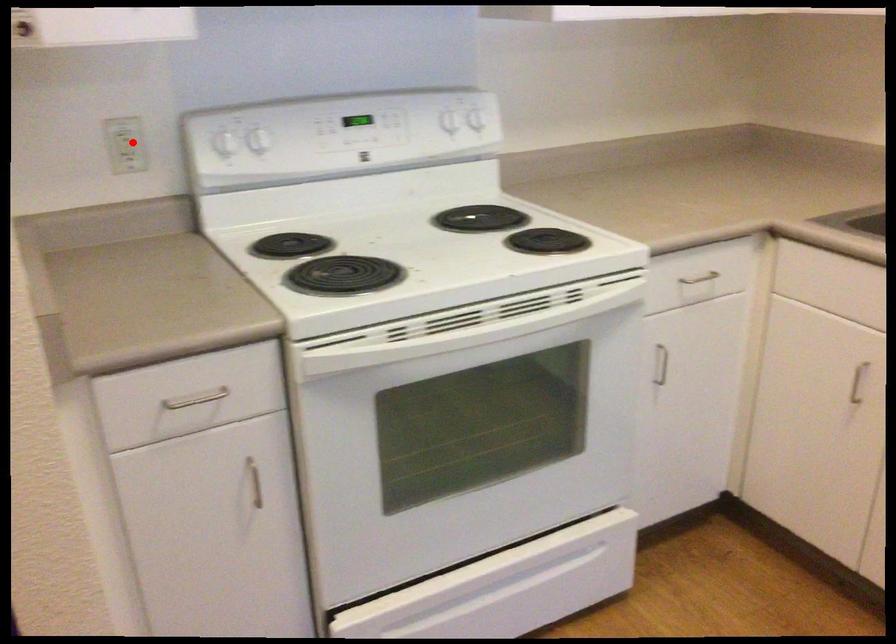
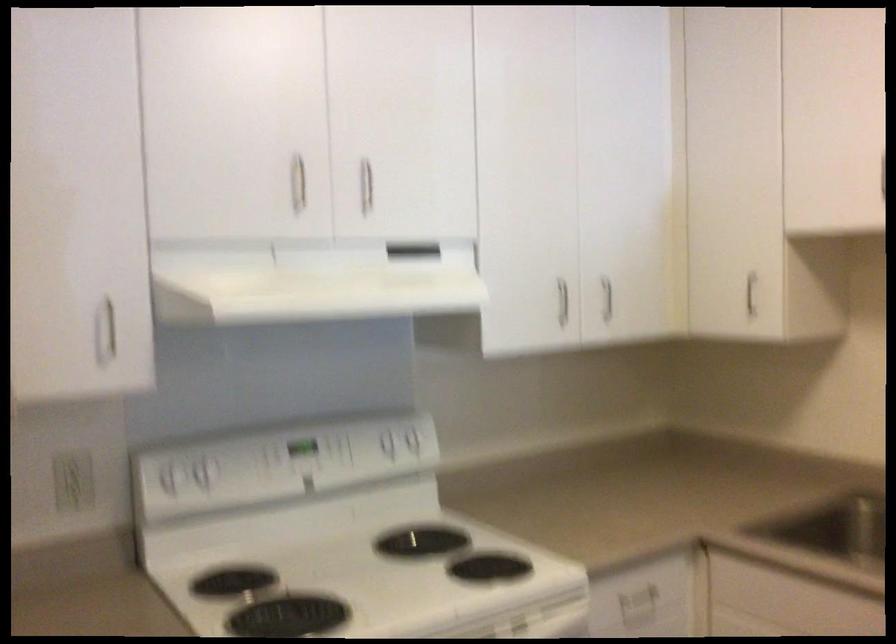
Locate, in the second image, the point that corresponds to the highlighted location in the first image.

(73, 480)